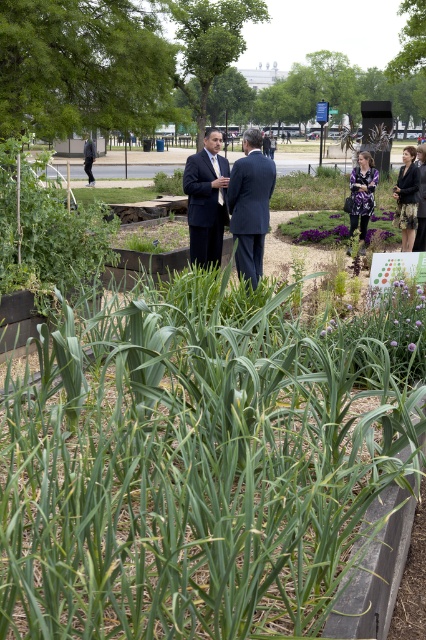
Question: Does green leafy plant at left appear on the right side of dark blue suit at left?

Choices:
 (A) no
 (B) yes

Answer: (B)

Question: Considering the real-world distances, which object is closest to the green leafy plant at left?

Choices:
 (A) purple floral dress at center
 (B) dark purple dress at right
 (C) dark blue suit at center

Answer: (C)

Question: Estimate the real-world distances between objects in this image. Which object is closer to the dark blue suit at center?

Choices:
 (A) green leafy plant at left
 (B) dark purple dress at right
 (C) matte black suit at center
 (D) purple floral dress at center

Answer: (C)

Question: Does dark blue suit at center appear over matte black suit at center?

Choices:
 (A) no
 (B) yes

Answer: (A)

Question: Which of the following is the closest to the observer?

Choices:
 (A) matte black suit at center
 (B) dark purple dress at right
 (C) dark blue suit at left
 (D) purple floral dress at center

Answer: (A)

Question: Is purple floral dress at center in front of dark blue suit at left?

Choices:
 (A) no
 (B) yes

Answer: (B)